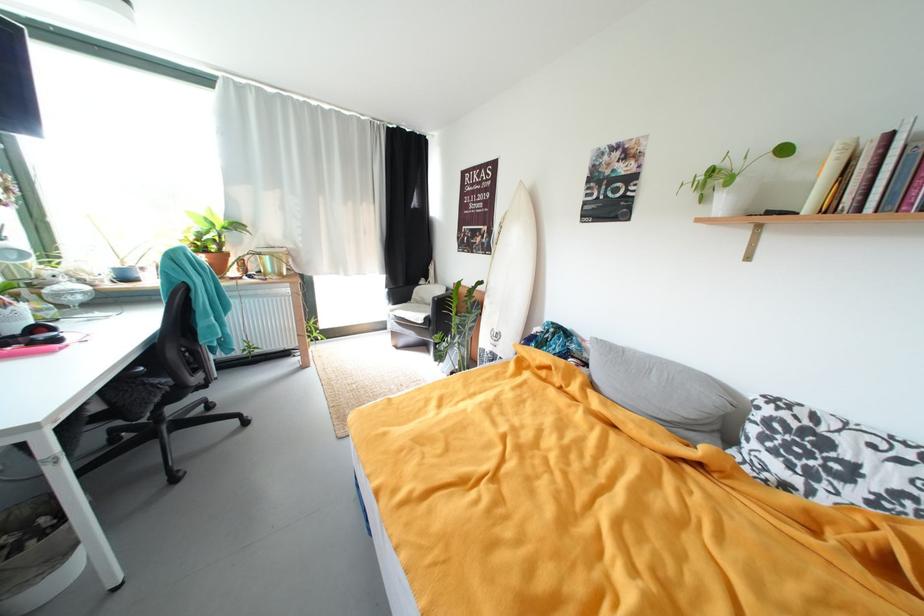
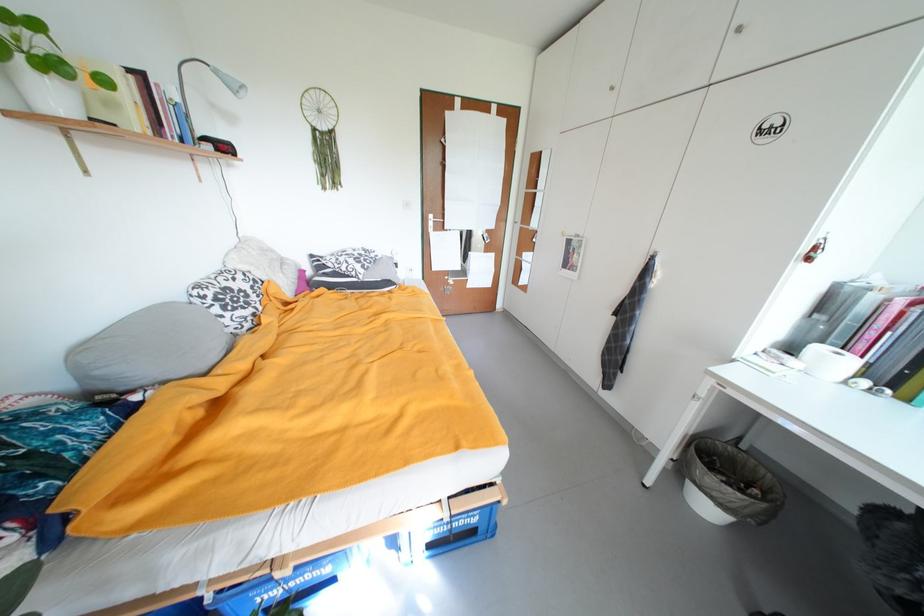
Locate, in the second image, the point that corresponds to (x=766, y=410) in the first image.

(211, 299)